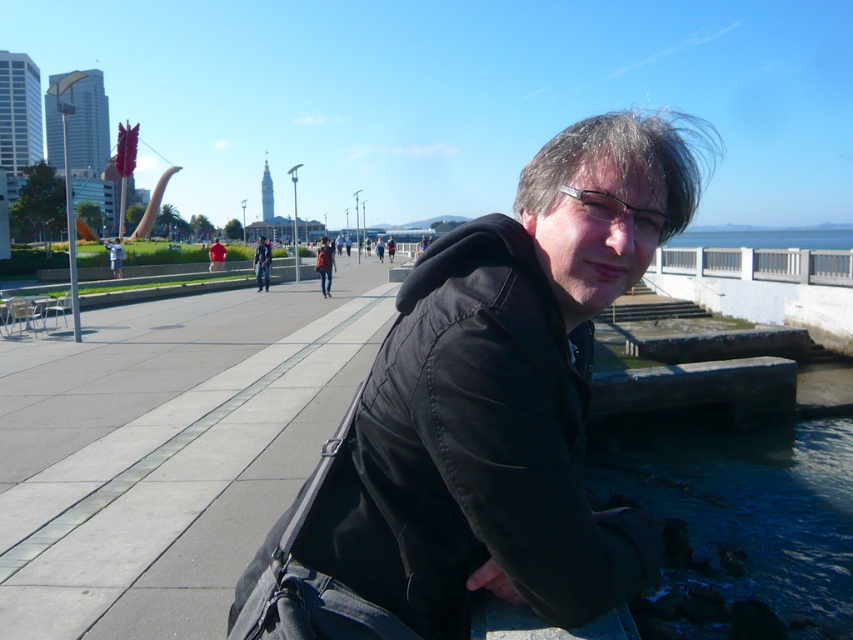
You are a fashion designer observing a person dressed in denim jeans at center and red fabric shirt at center. Which clothing item is positioned lower on their body?

The denim jeans at center is positioned lower on their body than the red fabric shirt at center.

You are standing on the waterfront promenade and want to determine which of the two points, point (262, 273) or point (218, 246), is closer to you. Based on the scene, which point is nearer?

Point (262, 273) is closer to the viewer than point (218, 246).

You are a fashion designer observing the person at the waterfront promenade. You notice the denim jeans at center and the red fabric shirt at center. Which clothing item appears narrower?

The denim jeans at center has a lesser width compared to the red fabric shirt at center, so the denim jeans at center appears narrower.